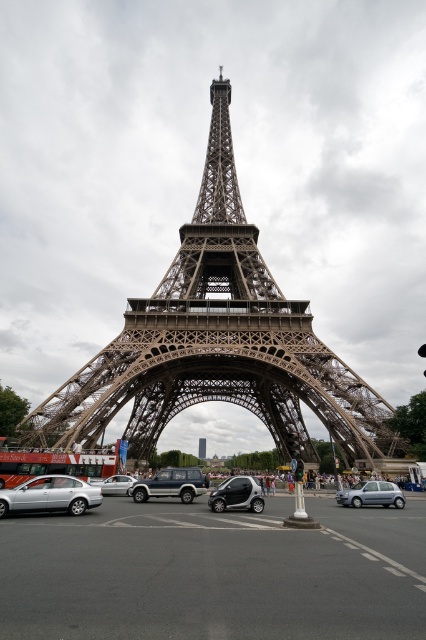
You are a photographer planning to capture the Eiffel Tower and the car in the same frame. Given that the brown metal eiffel tower at center is taller than the silver metallic car at lower left, how might the size of the tower compare to the car in your photo?

The brown metal eiffel tower at center appears larger in width compared to the silver metallic car at lower left in the image, so in the photo, the tower would dominate the scene and appear significantly bigger than the car.

You are a tourist standing on the street near the brown metal eiffel tower at center. You want to take a photo of the silver metallic car at lower left without the tower blocking it. Is this possible from your current position?

The silver metallic car at lower left is behind the brown metal eiffel tower at center, so you cannot take a photo of the silver metallic car at lower left without the tower blocking it from your current position.